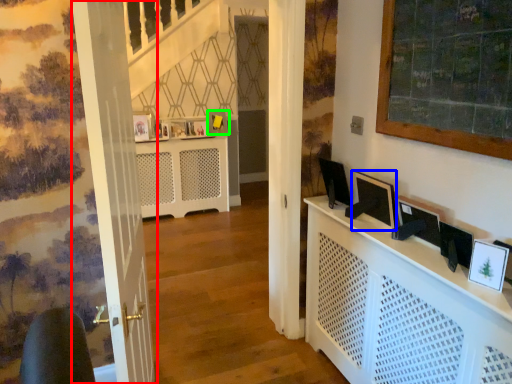
Question: Which object is the farthest from door (highlighted by a red box)? Choose among these: computer monitor (highlighted by a blue box) or picture frame (highlighted by a green box).

Choices:
 (A) computer monitor
 (B) picture frame

Answer: (B)